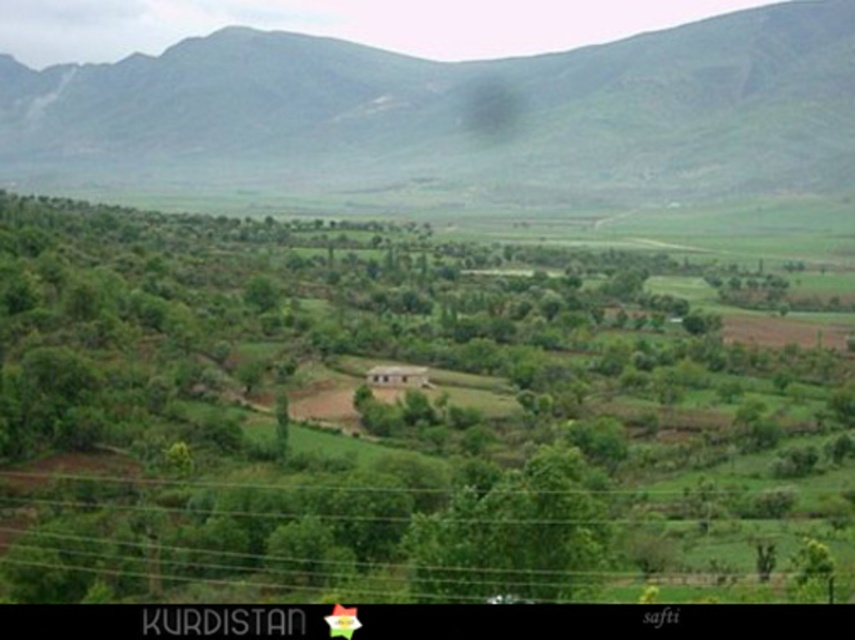
Who is positioned more to the right, green leafy tree at center or green grassy mountain at upper center?

Positioned to the right is green leafy tree at center.

Does green leafy tree at center have a lesser width compared to green grassy mountain at upper center?

Yes, green leafy tree at center is thinner than green grassy mountain at upper center.

Is point (541, 548) positioned in front of point (732, 179)?

Yes, it is in front of point (732, 179).

Locate an element on the screen. green leafy tree at center is located at coordinates (392, 419).